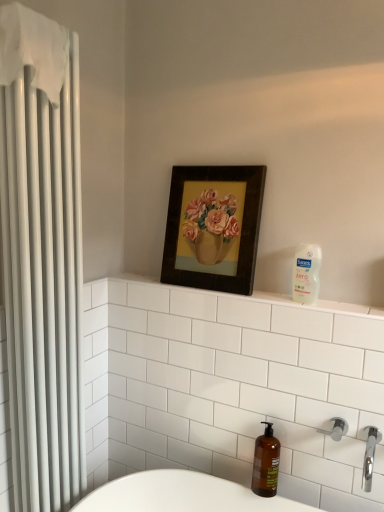
Where is `free space above clear plastic soap dispenser at upper right (from a real-world perspective)`? Image resolution: width=384 pixels, height=512 pixels. free space above clear plastic soap dispenser at upper right (from a real-world perspective) is located at coordinates (269, 290).